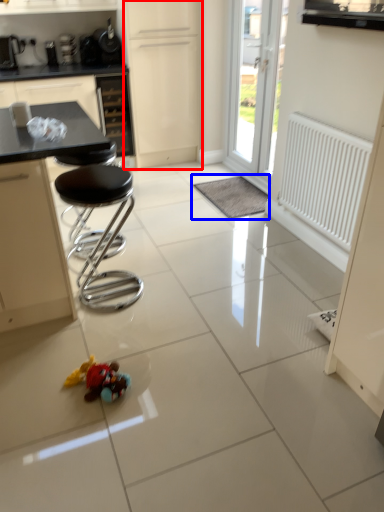
Question: Among these objects, which one is nearest to the camera, screen door (highlighted by a red box) or wide (highlighted by a blue box)?

Choices:
 (A) screen door
 (B) wide

Answer: (B)